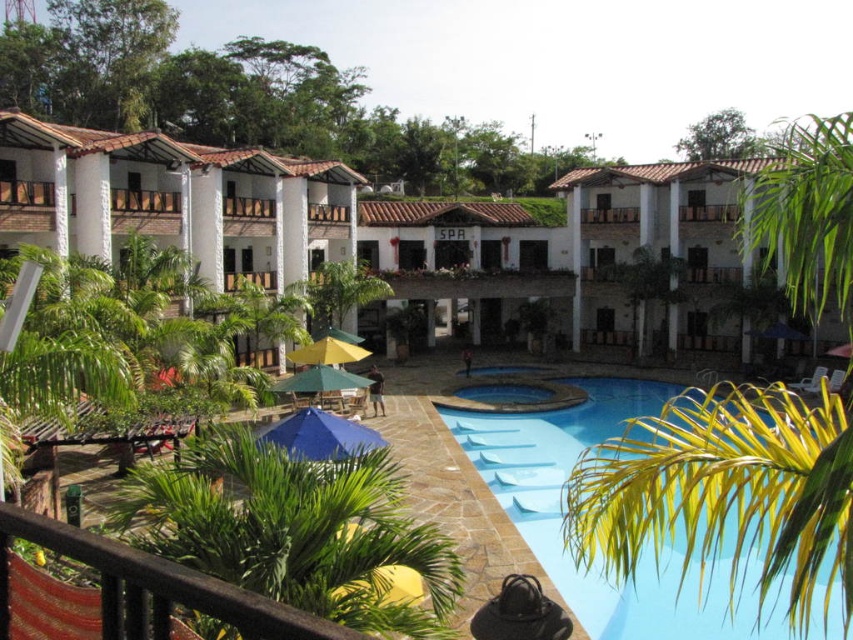
Question: Which object appears closest to the camera in this image?

Choices:
 (A) green fabric umbrella at center
 (B) yellow fabric umbrella at center
 (C) green leafy palm tree at lower left

Answer: (C)

Question: Which is nearer to the white stucco building at upper left?

Choices:
 (A) blue smooth pool at center
 (B) green leafy palm tree at right

Answer: (A)

Question: Among these objects, which one is farthest from the camera?

Choices:
 (A) yellow fabric umbrella at center
 (B) green leafy palm tree at lower left
 (C) green leafy palm tree at right

Answer: (A)

Question: Can you confirm if green leafy palm tree at right is positioned below white concrete balcony at upper center?

Choices:
 (A) no
 (B) yes

Answer: (A)

Question: Can you confirm if green fabric umbrella at center is positioned below white concrete balcony at upper center?

Choices:
 (A) no
 (B) yes

Answer: (B)

Question: Does green leafy palm tree at right appear on the left side of green leafy palm tree at lower left?

Choices:
 (A) yes
 (B) no

Answer: (B)